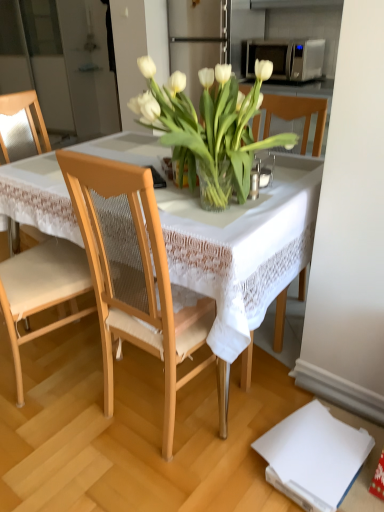
Locate an element on the screen. unoccupied region to the right of light wood chair at center, which ranks as the second chair in left-to-right order is located at coordinates (260, 395).